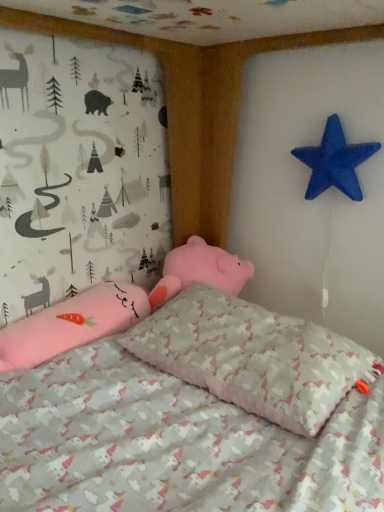
Question: From a real-world perspective, does unicorn-patterned fabric pillow at center stand above blue matte star at upper right?

Choices:
 (A) no
 (B) yes

Answer: (A)

Question: Can you confirm if unicorn-patterned fabric pillow at center is smaller than blue matte star at upper right?

Choices:
 (A) yes
 (B) no

Answer: (B)

Question: Is unicorn-patterned fabric pillow at center behind blue matte star at upper right?

Choices:
 (A) no
 (B) yes

Answer: (A)

Question: Is unicorn-patterned fabric pillow at center taller than blue matte star at upper right?

Choices:
 (A) yes
 (B) no

Answer: (B)

Question: Does unicorn-patterned fabric pillow at center appear on the left side of blue matte star at upper right?

Choices:
 (A) yes
 (B) no

Answer: (A)

Question: Would you say unicorn-patterned fabric pillow at center contains blue matte star at upper right?

Choices:
 (A) no
 (B) yes

Answer: (A)

Question: Does blue matte star at upper right contain unicorn-patterned fabric pillow at center?

Choices:
 (A) no
 (B) yes

Answer: (A)

Question: Would you consider blue matte star at upper right to be distant from unicorn-patterned fabric pillow at center?

Choices:
 (A) no
 (B) yes

Answer: (A)

Question: Can you confirm if blue matte star at upper right is taller than unicorn-patterned fabric pillow at center?

Choices:
 (A) yes
 (B) no

Answer: (A)

Question: Considering the relative positions of blue matte star at upper right and unicorn-patterned fabric pillow at center in the image provided, is blue matte star at upper right to the left of unicorn-patterned fabric pillow at center from the viewer's perspective?

Choices:
 (A) yes
 (B) no

Answer: (B)

Question: Is blue matte star at upper right at the right side of unicorn-patterned fabric pillow at center?

Choices:
 (A) yes
 (B) no

Answer: (A)

Question: From the image's perspective, would you say blue matte star at upper right is positioned over unicorn-patterned fabric pillow at center?

Choices:
 (A) no
 (B) yes

Answer: (B)

Question: Is unicorn-patterned fabric pillow at center taller or shorter than blue matte star at upper right?

Choices:
 (A) tall
 (B) short

Answer: (B)